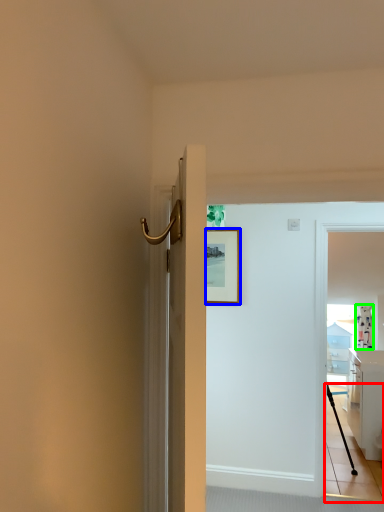
Question: Based on their relative distances, which object is nearer to path (highlighted by a red box)? Choose from picture frame (highlighted by a blue box) and curtain (highlighted by a green box).

Choices:
 (A) picture frame
 (B) curtain

Answer: (B)